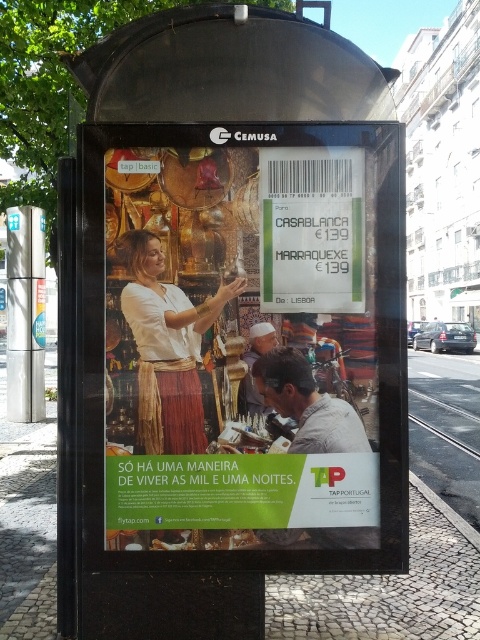
Looking at this image, does green matte sign at center have a greater width compared to white cotton blouse at center?

In fact, green matte sign at center might be narrower than white cotton blouse at center.

Does green matte sign at center have a smaller size compared to white cotton blouse at center?

Yes.

This screenshot has width=480, height=640. What do you see at coordinates (312, 228) in the screenshot? I see `green matte sign at center` at bounding box center [312, 228].

Locate an element on the screen. The image size is (480, 640). green matte sign at center is located at coordinates (312, 228).

Who is positioned more to the left, black plastic bus stop at center or cobblestone pavement at lower center?

black plastic bus stop at center is more to the left.

Based on the photo, who is lower down, black plastic bus stop at center or cobblestone pavement at lower center?

cobblestone pavement at lower center

Describe the element at coordinates (228, 321) in the screenshot. The image size is (480, 640). I see `black plastic bus stop at center` at that location.

Where is `black plastic bus stop at center`? This screenshot has width=480, height=640. black plastic bus stop at center is located at coordinates (228, 321).

Which is more to the right, cobblestone pavement at lower center or white cotton blouse at center?

cobblestone pavement at lower center

The width and height of the screenshot is (480, 640). What are the coordinates of `cobblestone pavement at lower center` in the screenshot? It's located at (388, 589).

Locate an element on the screen. cobblestone pavement at lower center is located at coordinates (388, 589).

At what (x,y) coordinates should I click in order to perform the action: click on cobblestone pavement at lower center. Please return your answer as a coordinate pair (x, y). Looking at the image, I should click on click(388, 589).